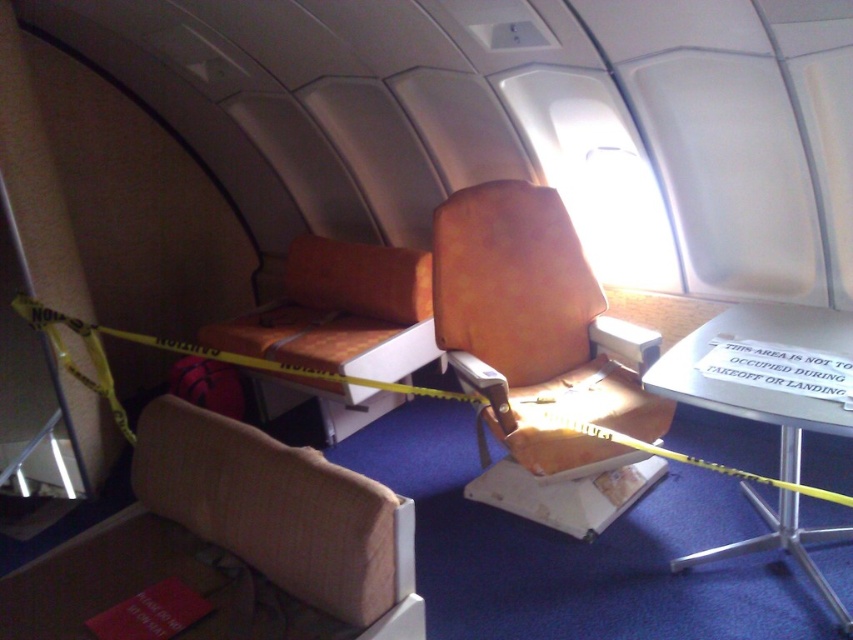
Is the position of leather-like orange armchair at center less distant than that of beige fabric armchair at lower left?

No, leather-like orange armchair at center is further to the viewer.

Which is more to the left, leather-like orange armchair at center or beige fabric armchair at lower left?

beige fabric armchair at lower left

Is point (440, 310) farther from viewer compared to point (193, 416)?

Yes, it is behind point (193, 416).

You are a GUI agent. You are given a task and a screenshot of the screen. Output one action in this format:
    pyautogui.click(x=<x>, y=<y>)
    Task: Click on the leather-like orange armchair at center
    The width and height of the screenshot is (853, 640).
    Given the screenshot: What is the action you would take?
    pyautogui.click(x=543, y=356)

Measure the distance between leather-like orange armchair at center and matte orange armchair at center.

leather-like orange armchair at center is 32.26 inches from matte orange armchair at center.

Who is higher up, leather-like orange armchair at center or matte orange armchair at center?

matte orange armchair at center is higher up.

Who is more distant from viewer, [460,195] or [300,349]?

Point [300,349]

Locate an element on the screen. This screenshot has height=640, width=853. leather-like orange armchair at center is located at coordinates coord(543,356).

Is beige fabric armchair at lower left below matte orange armchair at center?

Yes.

Can you confirm if beige fabric armchair at lower left is wider than matte orange armchair at center?

No.

The width and height of the screenshot is (853, 640). I want to click on beige fabric armchair at lower left, so click(x=283, y=515).